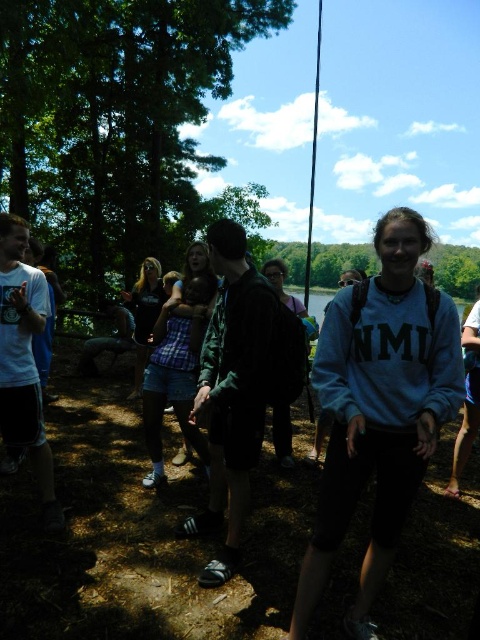
Measure the distance from plaid fabric child at center to black plastic fishing pole at center.

plaid fabric child at center is 43.83 feet away from black plastic fishing pole at center.

Does plaid fabric child at center appear on the right side of black plastic fishing pole at center?

In fact, plaid fabric child at center is to the left of black plastic fishing pole at center.

Describe the element at coordinates (178, 358) in the screenshot. I see `plaid fabric child at center` at that location.

Where is `plaid fabric child at center`? plaid fabric child at center is located at coordinates (178, 358).

Does gray fleece sweatshirt at center appear under black plastic fishing pole at center?

Yes, gray fleece sweatshirt at center is below black plastic fishing pole at center.

Between gray fleece sweatshirt at center and black plastic fishing pole at center, which one has less height?

gray fleece sweatshirt at center is shorter.

Image resolution: width=480 pixels, height=640 pixels. Find the location of `gray fleece sweatshirt at center`. gray fleece sweatshirt at center is located at coordinates (379, 406).

This screenshot has height=640, width=480. In order to click on gray fleece sweatshirt at center in this screenshot , I will do `click(379, 406)`.

Describe the element at coordinates (379, 406) in the screenshot. I see `gray fleece sweatshirt at center` at that location.

You are a GUI agent. You are given a task and a screenshot of the screen. Output one action in this format:
    pyautogui.click(x=<x>, y=<y>)
    Task: Click on the gray fleece sweatshirt at center
    Image resolution: width=480 pixels, height=640 pixels.
    Given the screenshot: What is the action you would take?
    tap(379, 406)

Identify the location of gray fleece sweatshirt at center. (379, 406).